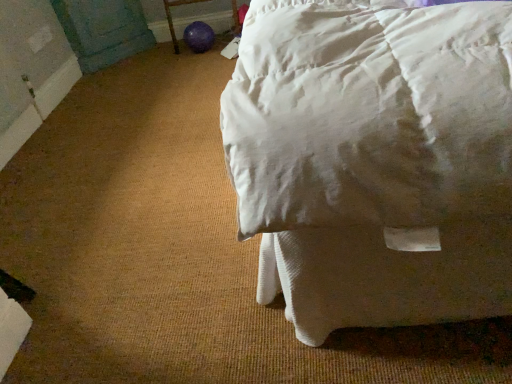
In order to face purple rubber ball at lower center, should I rotate leftwards or rightwards?

A 8.790 degree turn to the left will do.

What do you see at coordinates (172, 19) in the screenshot? I see `purple rubber ball at lower center` at bounding box center [172, 19].

Locate an element on the screen. The image size is (512, 384). purple rubber ball at lower center is located at coordinates (172, 19).

What do you see at coordinates (374, 158) in the screenshot? I see `white cotton bed at upper right` at bounding box center [374, 158].

Find the location of a particular element. white cotton bed at upper right is located at coordinates (374, 158).

Locate an element on the screen. purple rubber ball at lower center is located at coordinates (172, 19).

Does purple rubber ball at lower center appear on the left side of white cotton bed at upper right?

Correct, you'll find purple rubber ball at lower center to the left of white cotton bed at upper right.

Is purple rubber ball at lower center in front of or behind white cotton bed at upper right in the image?

purple rubber ball at lower center is positioned farther from the viewer than white cotton bed at upper right.

Which is in front, point (234, 10) or point (355, 196)?

The point (355, 196) is more forward.

From the image's perspective, relative to white cotton bed at upper right, is purple rubber ball at lower center above or below?

purple rubber ball at lower center is situated higher than white cotton bed at upper right in the image.

From a real-world perspective, is purple rubber ball at lower center located higher than white cotton bed at upper right?

Correct, in the physical world, purple rubber ball at lower center is higher than white cotton bed at upper right.

Between purple rubber ball at lower center and white cotton bed at upper right, which one has larger width?

Wider between the two is white cotton bed at upper right.

In the scene shown: Is purple rubber ball at lower center taller than white cotton bed at upper right?

Yes.

Which of these two, purple rubber ball at lower center or white cotton bed at upper right, is bigger?

white cotton bed at upper right is bigger.

Would you say purple rubber ball at lower center contains white cotton bed at upper right?

Definitely not — white cotton bed at upper right is not inside purple rubber ball at lower center.

Is purple rubber ball at lower center beside white cotton bed at upper right?

No, purple rubber ball at lower center is not next to white cotton bed at upper right.

Is purple rubber ball at lower center positioned with its back to white cotton bed at upper right?

No.

How many degrees apart are the facing directions of purple rubber ball at lower center and white cotton bed at upper right?

purple rubber ball at lower center and white cotton bed at upper right are facing 88.4 degrees away from each other.

Measure the distance between purple rubber ball at lower center and white cotton bed at upper right.

The distance of purple rubber ball at lower center from white cotton bed at upper right is 2.25 meters.

I want to click on furniture above the white cotton bed at upper right (from a real-world perspective), so tap(172, 19).

Which object is positioned more to the right, white cotton bed at upper right or purple rubber ball at lower center?

From the viewer's perspective, white cotton bed at upper right appears more on the right side.

Which object is further away from the camera, white cotton bed at upper right or purple rubber ball at lower center?

purple rubber ball at lower center is further from the camera.

Considering the positions of point (328, 229) and point (234, 2), is point (328, 229) closer or farther from the camera than point (234, 2)?

Point (328, 229) is closer to the camera than point (234, 2).

Looking at this image, from the image's perspective, is white cotton bed at upper right above or below purple rubber ball at lower center?

Based on their image positions, white cotton bed at upper right is located beneath purple rubber ball at lower center.

From a real-world perspective, is white cotton bed at upper right located higher than purple rubber ball at lower center?

No, from a real-world perspective, white cotton bed at upper right is not over purple rubber ball at lower center

Can you confirm if white cotton bed at upper right is wider than purple rubber ball at lower center?

Indeed, white cotton bed at upper right has a greater width compared to purple rubber ball at lower center.

Between white cotton bed at upper right and purple rubber ball at lower center, which one has more height?

With more height is purple rubber ball at lower center.

Considering the relative sizes of white cotton bed at upper right and purple rubber ball at lower center in the image provided, is white cotton bed at upper right bigger than purple rubber ball at lower center?

Yes.

Is purple rubber ball at lower center located within white cotton bed at upper right?

No, white cotton bed at upper right does not contain purple rubber ball at lower center.

Are white cotton bed at upper right and purple rubber ball at lower center beside each other?

white cotton bed at upper right is not next to purple rubber ball at lower center, and they're not touching.

In the scene shown: Is white cotton bed at upper right looking in the opposite direction of purple rubber ball at lower center?

No, white cotton bed at upper right is not facing away from purple rubber ball at lower center.

At what (x,y) coordinates should I click in order to perform the action: click on bed located on the right of purple rubber ball at lower center. Please return your answer as a coordinate pair (x, y). The height and width of the screenshot is (384, 512). Looking at the image, I should click on (374, 158).

Locate an element on the screen. bed that appears below the purple rubber ball at lower center (from the image's perspective) is located at coordinates (x=374, y=158).

Image resolution: width=512 pixels, height=384 pixels. Find the location of `furniture to the left of white cotton bed at upper right`. furniture to the left of white cotton bed at upper right is located at coordinates (172, 19).